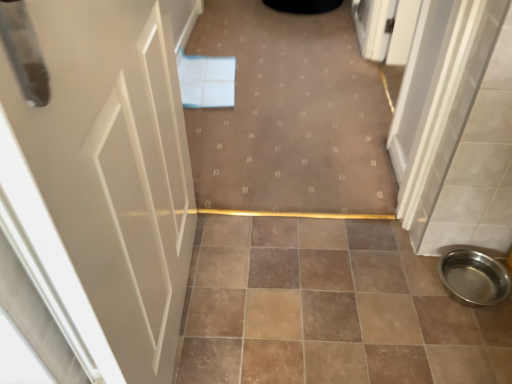
This screenshot has width=512, height=384. Describe the element at coordinates (291, 115) in the screenshot. I see `carpet at center` at that location.

What are the coordinates of `white glossy door at left` in the screenshot? It's located at (105, 177).

The image size is (512, 384). Identify the location of polished stainless steel bowl at lower right. tap(474, 277).

Find the location of a particular element. The image size is (512, 384). carpet at center is located at coordinates (291, 115).

Considering the relative positions of white glossy door at left and brown ceramic tile at center in the image provided, is white glossy door at left to the left of brown ceramic tile at center from the viewer's perspective?

Yes, white glossy door at left is to the left of brown ceramic tile at center.

From the image's perspective, which is above, white glossy door at left or brown ceramic tile at center?

white glossy door at left.

Which object is thinner, white glossy door at left or brown ceramic tile at center?

With smaller width is white glossy door at left.

Identify the location of door that appears above the brown ceramic tile at center (from the image's perspective). The width and height of the screenshot is (512, 384). (105, 177).

Considering the positions of point (96, 101) and point (222, 111), is point (96, 101) closer or farther from the camera than point (222, 111)?

Point (96, 101).

Is carpet at center inside white glossy door at left?

No, carpet at center is not surrounded by white glossy door at left.

Does white glossy door at left turn towards carpet at center?

No, white glossy door at left does not turn towards carpet at center.

From the image's perspective, which object appears higher, white glossy door at left or carpet at center?

From the image's view, carpet at center is above.

Is white glossy door at left not near polished stainless steel bowl at lower right?

No, there isn't a large distance between white glossy door at left and polished stainless steel bowl at lower right.

Which object is further away from the camera taking this photo, white glossy door at left or polished stainless steel bowl at lower right?

polished stainless steel bowl at lower right is further from the camera.

From the image's perspective, is white glossy door at left on top of polished stainless steel bowl at lower right?

Yes.

Is white glossy door at left not within polished stainless steel bowl at lower right?

Yes, white glossy door at left is not within polished stainless steel bowl at lower right.

Who is more distant, brown ceramic tile at center or carpet at center?

carpet at center is more distant.

Is the surface of brown ceramic tile at center in direct contact with carpet at center?

No, brown ceramic tile at center is not with carpet at center.

Is brown ceramic tile at center wider than carpet at center?

No, brown ceramic tile at center is not wider than carpet at center.

Can you tell me how much brown ceramic tile at center and carpet at center differ in facing direction?

180 degrees separate the facing orientations of brown ceramic tile at center and carpet at center.

Is carpet at center positioned far away from polished stainless steel bowl at lower right?

No, carpet at center is not far away from polished stainless steel bowl at lower right.

Can you confirm if carpet at center is wider than polished stainless steel bowl at lower right?

Yes, carpet at center is wider than polished stainless steel bowl at lower right.

Does point (275, 64) lie behind point (490, 303)?

Yes.

Which object is further away from the camera, carpet at center or polished stainless steel bowl at lower right?

carpet at center is behind.

How many degrees apart are the facing directions of carpet at center and brown ceramic tile at center?

carpet at center and brown ceramic tile at center are facing 180 degrees away from each other.

Consider the image. Is carpet at center located outside brown ceramic tile at center?

Yes, carpet at center is not within brown ceramic tile at center.

Is carpet at center beside brown ceramic tile at center?

No, carpet at center is not making contact with brown ceramic tile at center.

In terms of size, does carpet at center appear bigger or smaller than brown ceramic tile at center?

Clearly, carpet at center is larger in size than brown ceramic tile at center.

You are a GUI agent. You are given a task and a screenshot of the screen. Output one action in this format:
    pyautogui.click(x=<x>, y=<y>)
    Task: Click on the toilet bowl below the white glossy door at left (from the image's perspective)
    
    Given the screenshot: What is the action you would take?
    pyautogui.click(x=474, y=277)

Is polished stainless steel bowl at lower right to the left of white glossy door at left from the viewer's perspective?

In fact, polished stainless steel bowl at lower right is to the right of white glossy door at left.

From a real-world perspective, is polished stainless steel bowl at lower right above or below white glossy door at left?

In terms of real-world spatial position, polished stainless steel bowl at lower right is below white glossy door at left.

In the image, there is a white glossy door at left. In order to click on ceramic tile below it (from the image's perspective) in this screenshot , I will do `click(329, 308)`.

The height and width of the screenshot is (384, 512). There is a carpet at center. Identify the location of door above it (from a real-world perspective). (x=105, y=177).

From the image, which object appears to be nearer to polished stainless steel bowl at lower right, carpet at center or brown ceramic tile at center?

brown ceramic tile at center is closer to polished stainless steel bowl at lower right.

Which object lies further to the anchor point carpet at center, brown ceramic tile at center or white glossy door at left?

The object further to carpet at center is white glossy door at left.

In the scene shown: Based on their spatial positions, is polished stainless steel bowl at lower right or brown ceramic tile at center further from white glossy door at left?

Based on the image, polished stainless steel bowl at lower right appears to be further to white glossy door at left.

Looking at the image, which one is located further to carpet at center, white glossy door at left or brown ceramic tile at center?

white glossy door at left lies further to carpet at center than the other object.

Considering their positions, is polished stainless steel bowl at lower right positioned closer to white glossy door at left than carpet at center?

carpet at center is positioned closer to the anchor white glossy door at left.

Estimate the real-world distances between objects in this image. Which object is closer to carpet at center, polished stainless steel bowl at lower right or brown ceramic tile at center?

brown ceramic tile at center is closer to carpet at center.

When comparing their distances from white glossy door at left, does carpet at center or brown ceramic tile at center seem closer?

brown ceramic tile at center is closer to white glossy door at left.

Which object lies further to the anchor point polished stainless steel bowl at lower right, white glossy door at left or carpet at center?

white glossy door at left is positioned further to the anchor polished stainless steel bowl at lower right.

Locate an element on the screen. This screenshot has height=384, width=512. ceramic tile positioned between white glossy door at left and polished stainless steel bowl at lower right from near to far is located at coordinates (329, 308).

The width and height of the screenshot is (512, 384). I want to click on ceramic tile between white glossy door at left and carpet at center from front to back, so click(x=329, y=308).

This screenshot has height=384, width=512. I want to click on toilet bowl between carpet at center and brown ceramic tile at center in the vertical direction, so click(474, 277).

Find the location of a particular element. The width and height of the screenshot is (512, 384). toilet bowl between white glossy door at left and carpet at center in the front-back direction is located at coordinates (474, 277).